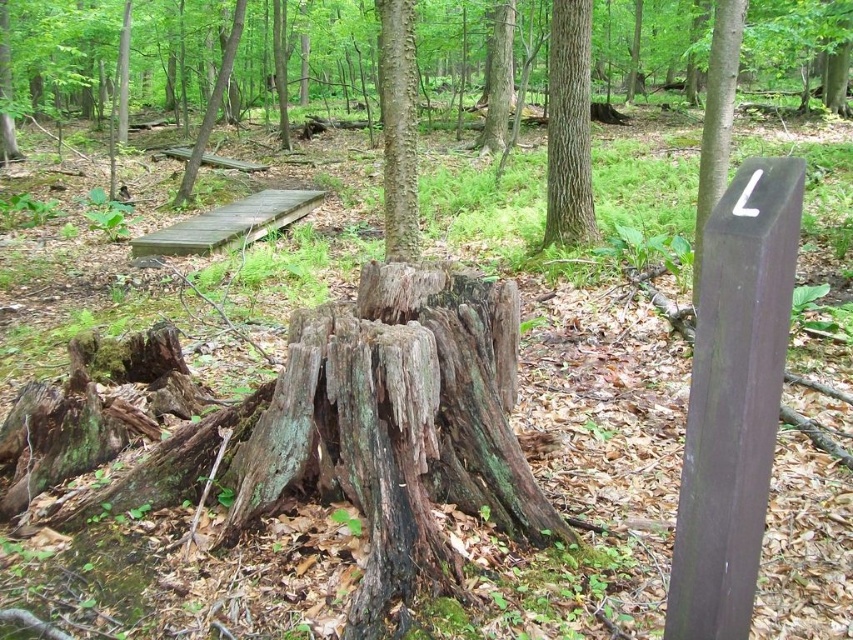
You are a hiker who needs to place a small backpack on the largest object in the scene. Which object should you choose between the brown rough wood post at upper right and the brown wooden plank at upper left?

The brown wooden plank at upper left is larger than the brown rough wood post at upper right, so you should place your backpack on the brown wooden plank at upper left.

Looking at this image, you are a hiker who has just found a trail marker with an L on it. You notice two objects in the scene described in the image. One is the smooth brown tree trunk at upper center and the other is the green mossy stump at upper center. Which of these two objects is positioned higher up in the image?

The smooth brown tree trunk at upper center is located above the green mossy stump at upper center, so it is positioned higher up in the image.

You are standing in the forest and see the brown rough wood post at upper right. If you want to place a 10 feet long rope between you and the post, will it be long enough to reach?

The distance between you and the brown rough wood post at upper right is 11.30 feet. Since the rope is only 10 feet long, it is not long enough to span the distance between you and the post.